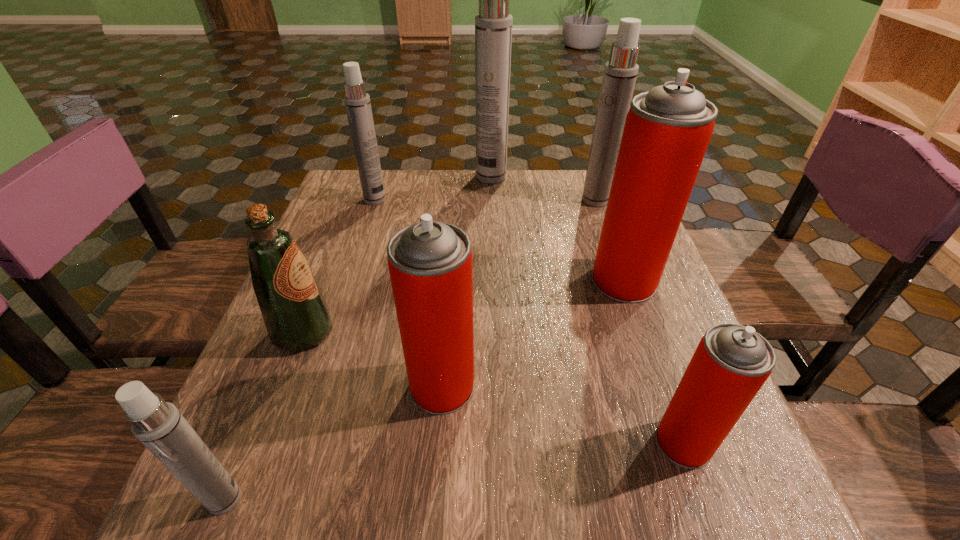
Where is `olive oil`? This screenshot has height=540, width=960. olive oil is located at coordinates (295, 313).

The image size is (960, 540). Find the location of `the seventh farthest object`. the seventh farthest object is located at coordinates (731, 363).

The height and width of the screenshot is (540, 960). I want to click on the sixth farthest aerosol can, so pos(731,363).

In order to click on the leftmost white aerosol can in this screenshot , I will do `click(158, 425)`.

This screenshot has width=960, height=540. In order to click on the smallest white aerosol can in this screenshot , I will do `click(158, 425)`.

Find the location of `blank area located on the front of the tallest object`. blank area located on the front of the tallest object is located at coordinates (492, 215).

Locate an element on the screen. The height and width of the screenshot is (540, 960). vacant position located on the left of the rightmost white aerosol can is located at coordinates (517, 200).

I want to click on free space located 0.200m on the back of the biggest red aerosol can, so click(600, 213).

You are a GUI agent. You are given a task and a screenshot of the screen. Output one action in this format:
    pyautogui.click(x=<x>, y=<y>)
    Task: Click on the free space located on the right of the second smallest red aerosol can
    This screenshot has height=540, width=960.
    Given the screenshot: What is the action you would take?
    pyautogui.click(x=509, y=386)

You are a GUI agent. You are given a task and a screenshot of the screen. Output one action in this format:
    pyautogui.click(x=<x>, y=<y>)
    Task: Click on the vacant region located 0.090m on the back of the second smallest white aerosol can
    The image size is (960, 540).
    Given the screenshot: What is the action you would take?
    pyautogui.click(x=382, y=178)